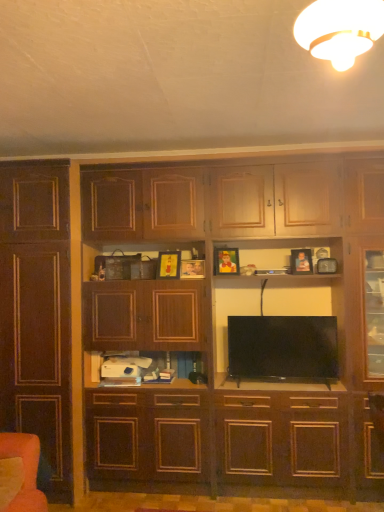
Question: From the image's perspective, would you say dark wood cabinet at left is shown under matte brown cabinet at center?

Choices:
 (A) no
 (B) yes

Answer: (A)

Question: Is dark wood cabinet at left positioned behind matte brown cabinet at center?

Choices:
 (A) yes
 (B) no

Answer: (B)

Question: Does dark wood cabinet at left have a greater width compared to matte brown cabinet at center?

Choices:
 (A) no
 (B) yes

Answer: (B)

Question: Is dark wood cabinet at left turned away from matte brown cabinet at center?

Choices:
 (A) no
 (B) yes

Answer: (A)

Question: From the image's perspective, is dark wood cabinet at left above matte brown cabinet at center?

Choices:
 (A) yes
 (B) no

Answer: (A)

Question: From the image's perspective, relative to matte brown cabinet at center, is dark wood cupboard at center above or below?

Choices:
 (A) below
 (B) above

Answer: (B)

Question: Considering their positions, is dark wood cupboard at center located in front of or behind matte brown cabinet at center?

Choices:
 (A) front
 (B) behind

Answer: (A)

Question: Choose the correct answer: Is dark wood cupboard at center inside matte brown cabinet at center or outside it?

Choices:
 (A) inside
 (B) outside

Answer: (B)

Question: Is point (339, 377) positioned closer to the camera than point (192, 356)?

Choices:
 (A) closer
 (B) farther

Answer: (A)

Question: From the image's perspective, relative to dark wood cabinet at left, is dark wood cupboard at center above or below?

Choices:
 (A) below
 (B) above

Answer: (B)

Question: Is point (271, 482) positioned closer to the camera than point (31, 166)?

Choices:
 (A) closer
 (B) farther

Answer: (A)

Question: Is dark wood cupboard at center inside or outside of dark wood cabinet at left?

Choices:
 (A) inside
 (B) outside

Answer: (B)

Question: Considering the positions of dark wood cupboard at center and dark wood cabinet at left in the image, is dark wood cupboard at center bigger or smaller than dark wood cabinet at left?

Choices:
 (A) big
 (B) small

Answer: (A)

Question: From the image's perspective, relative to matte brown cabinet at center, is orange fabric armchair at lower left above or below?

Choices:
 (A) above
 (B) below

Answer: (B)

Question: Is orange fabric armchair at lower left inside the boundaries of matte brown cabinet at center, or outside?

Choices:
 (A) inside
 (B) outside

Answer: (B)